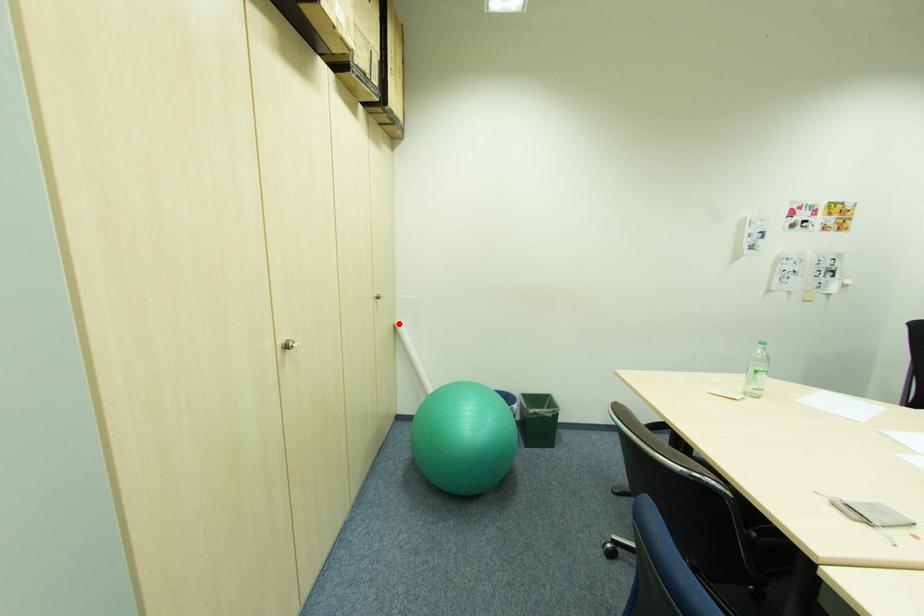
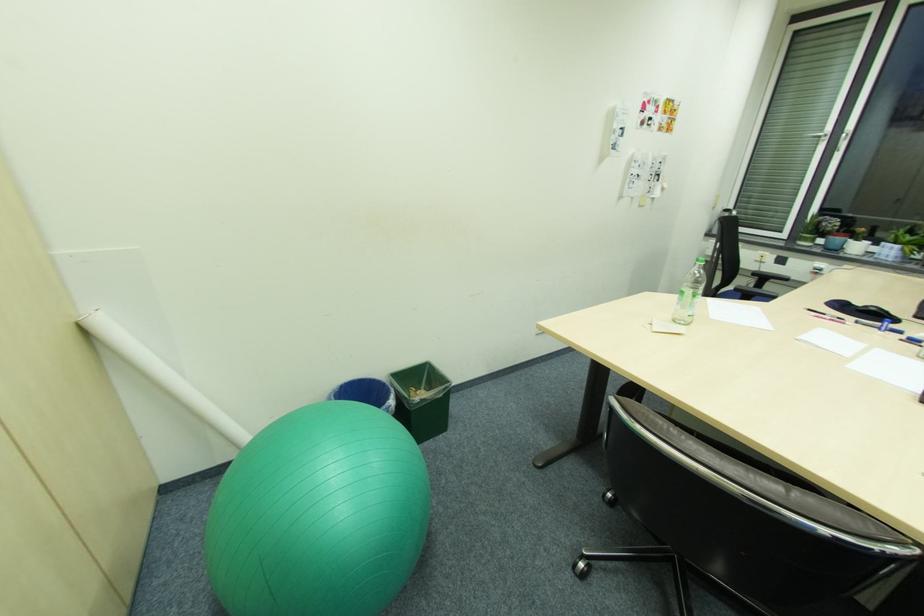
The point at the highlighted location is marked in the first image. Where is the corresponding point in the second image?

(79, 321)